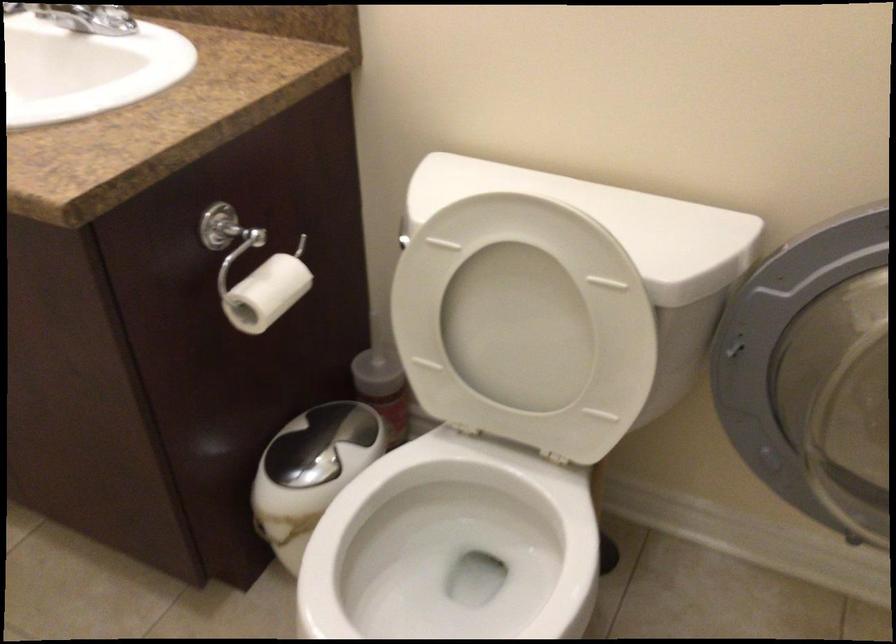
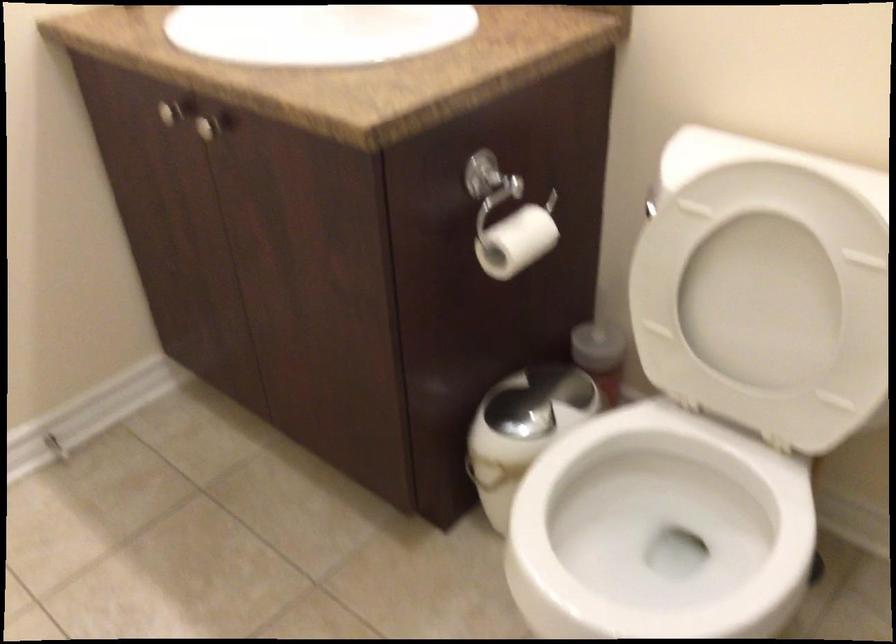
Locate, in the second image, the point that corresponds to (524,327) in the first image.

(763, 299)